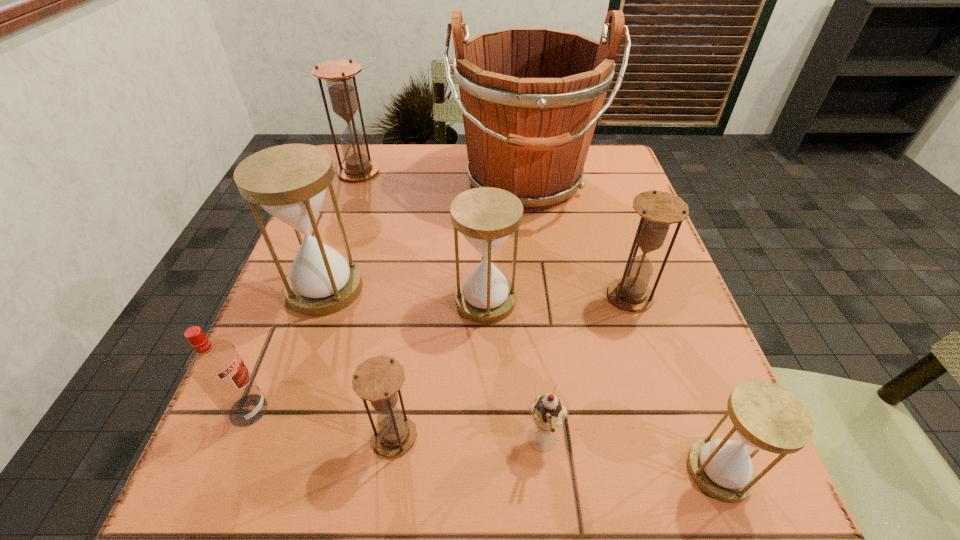
I want to click on free space located on the back of the smallest brown hourglass, so click(420, 263).

You are a GUI agent. You are given a task and a screenshot of the screen. Output one action in this format:
    pyautogui.click(x=<x>, y=<y>)
    Task: Click on the free space located on the left of the rightmost white hourglass
    The width and height of the screenshot is (960, 540).
    Given the screenshot: What is the action you would take?
    pyautogui.click(x=466, y=470)

Where is `free space located on the back of the shortest object`? Image resolution: width=960 pixels, height=540 pixels. free space located on the back of the shortest object is located at coordinates (526, 276).

Locate an element on the screen. This screenshot has width=960, height=540. bucket at the far edge is located at coordinates (530, 97).

You are a GUI agent. You are given a task and a screenshot of the screen. Output one action in this format:
    pyautogui.click(x=<x>, y=<y>)
    Task: Click on the hourglass present at the far edge
    
    Given the screenshot: What is the action you would take?
    pyautogui.click(x=338, y=74)

Locate an element on the screen. The width and height of the screenshot is (960, 540). object that is positioned at the near edge is located at coordinates (765, 416).

What are the coordinates of `vodka present at the left edge` in the screenshot? It's located at (216, 366).

Locate an element on the screen. The height and width of the screenshot is (540, 960). bucket at the right edge is located at coordinates (530, 97).

Where is `object positioned at the far left corner`? This screenshot has width=960, height=540. object positioned at the far left corner is located at coordinates (338, 74).

The height and width of the screenshot is (540, 960). What are the coordinates of `object that is at the far right corner` in the screenshot? It's located at (530, 97).